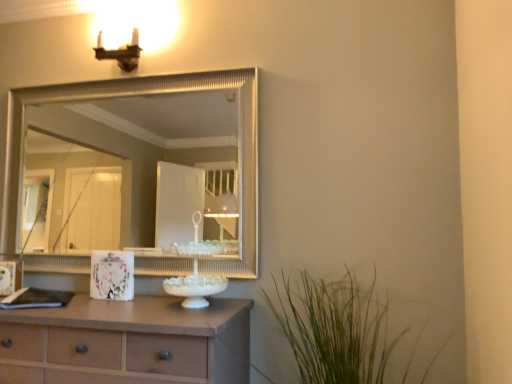
Question: Can you confirm if matte brown chest of drawers at lower left is positioned to the left of silver textured mirror at upper center?

Choices:
 (A) yes
 (B) no

Answer: (A)

Question: From the image's perspective, does matte brown chest of drawers at lower left appear lower than silver textured mirror at upper center?

Choices:
 (A) yes
 (B) no

Answer: (A)

Question: Is matte brown chest of drawers at lower left smaller than silver textured mirror at upper center?

Choices:
 (A) no
 (B) yes

Answer: (A)

Question: Would you say matte brown chest of drawers at lower left is a long distance from silver textured mirror at upper center?

Choices:
 (A) no
 (B) yes

Answer: (B)

Question: Is matte brown chest of drawers at lower left bigger than silver textured mirror at upper center?

Choices:
 (A) no
 (B) yes

Answer: (B)

Question: Is green grass at lower right bigger or smaller than matte brown chest of drawers at lower left?

Choices:
 (A) small
 (B) big

Answer: (A)

Question: Looking at their shapes, would you say green grass at lower right is wider or thinner than matte brown chest of drawers at lower left?

Choices:
 (A) thin
 (B) wide

Answer: (B)

Question: Is green grass at lower right spatially inside matte brown chest of drawers at lower left, or outside of it?

Choices:
 (A) outside
 (B) inside

Answer: (A)

Question: From their relative heights in the image, would you say green grass at lower right is taller or shorter than matte brown chest of drawers at lower left?

Choices:
 (A) tall
 (B) short

Answer: (A)

Question: Is point (189, 329) positioned closer to the camera than point (123, 266)?

Choices:
 (A) closer
 (B) farther

Answer: (A)

Question: From the image's perspective, relative to white glossy picture frame at center, is matte brown chest of drawers at lower left above or below?

Choices:
 (A) below
 (B) above

Answer: (A)

Question: Is matte brown chest of drawers at lower left bigger or smaller than white glossy picture frame at center?

Choices:
 (A) big
 (B) small

Answer: (A)

Question: Would you say matte brown chest of drawers at lower left is inside or outside white glossy picture frame at center?

Choices:
 (A) inside
 (B) outside

Answer: (B)

Question: In the image, is matte brown sconce at upper left positioned in front of or behind silver textured mirror at upper center?

Choices:
 (A) behind
 (B) front

Answer: (A)

Question: Considering the positions of point (121, 57) and point (174, 195), is point (121, 57) closer or farther from the camera than point (174, 195)?

Choices:
 (A) farther
 (B) closer

Answer: (B)